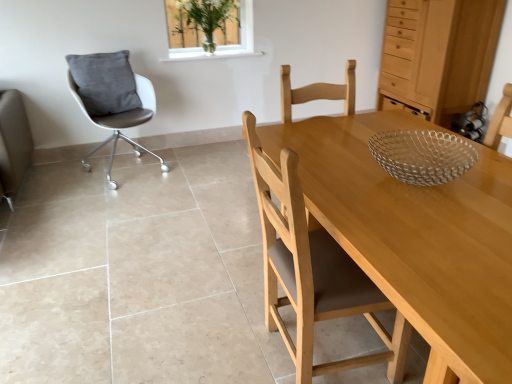
Question: Is light brown wood chair at center, positioned as the second chair in left-to-right order, inside or outside of white leather chair at left, which ranks as the second chair in right-to-left order?

Choices:
 (A) inside
 (B) outside

Answer: (B)

Question: Is light brown wood chair at center, which is counted as the first chair, starting from the right, wider or thinner than white leather chair at left, the 1th chair positioned from the left?

Choices:
 (A) thin
 (B) wide

Answer: (A)

Question: Which of these objects is positioned farthest from the light wood dresser at upper right?

Choices:
 (A) white leather chair at left, which ranks as the second chair in right-to-left order
 (B) gray velvety pillow at left
 (C) light brown wood chair at center, which is counted as the first chair, starting from the right
 (D) clear glass vase at upper center

Answer: (C)

Question: Based on their relative distances, which object is farther from the light wood dresser at upper right?

Choices:
 (A) clear glass vase at upper center
 (B) gray velvety pillow at left
 (C) white leather chair at left, which ranks as the second chair in right-to-left order
 (D) light brown wood chair at center, which ranks as the first chair in front-to-back order

Answer: (D)